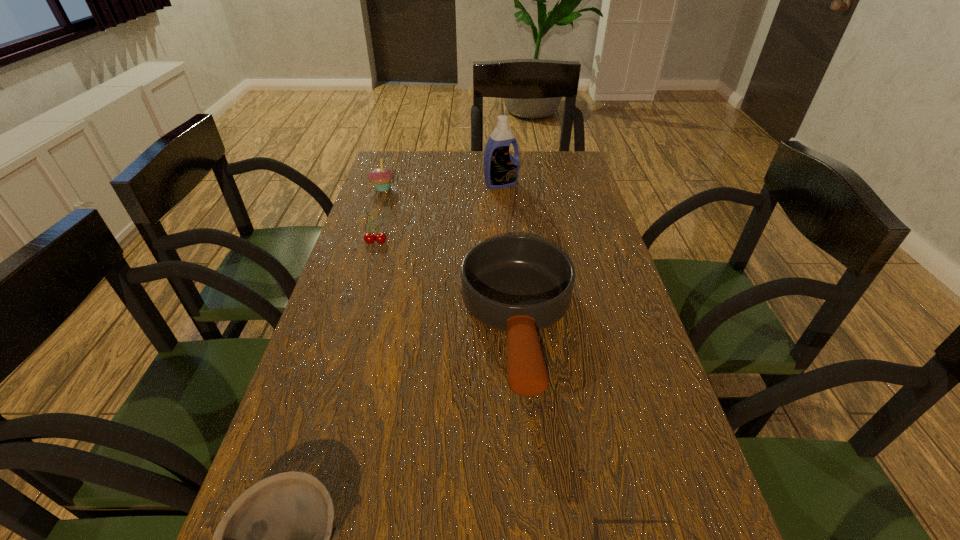
You are a GUI agent. You are given a task and a screenshot of the screen. Output one action in this format:
    pyautogui.click(x=<x>, y=<y>)
    Task: Click on the detergent
    
    Given the screenshot: What is the action you would take?
    pyautogui.click(x=501, y=170)

What are the coordinates of `the second tallest object` in the screenshot? It's located at (381, 177).

Find the location of `the second nearest object`. the second nearest object is located at coordinates (518, 284).

Where is `the third nearest object`? The image size is (960, 540). the third nearest object is located at coordinates (369, 238).

Locate an element on the screen. The width and height of the screenshot is (960, 540). free region located on the right of the detergent is located at coordinates (539, 184).

In order to click on vacant region located 0.210m on the front of the cupcake in this screenshot , I will do `click(369, 231)`.

This screenshot has width=960, height=540. In order to click on free point located on the handle side of the fourth farthest object in this screenshot , I will do `click(535, 501)`.

I want to click on free space located 0.210m with the stems of the cherry pointing upwards, so click(x=360, y=298).

Identify the location of detergent that is at the far edge. (501, 170).

Locate an element on the screen. The height and width of the screenshot is (540, 960). cupcake present at the far edge is located at coordinates (381, 177).